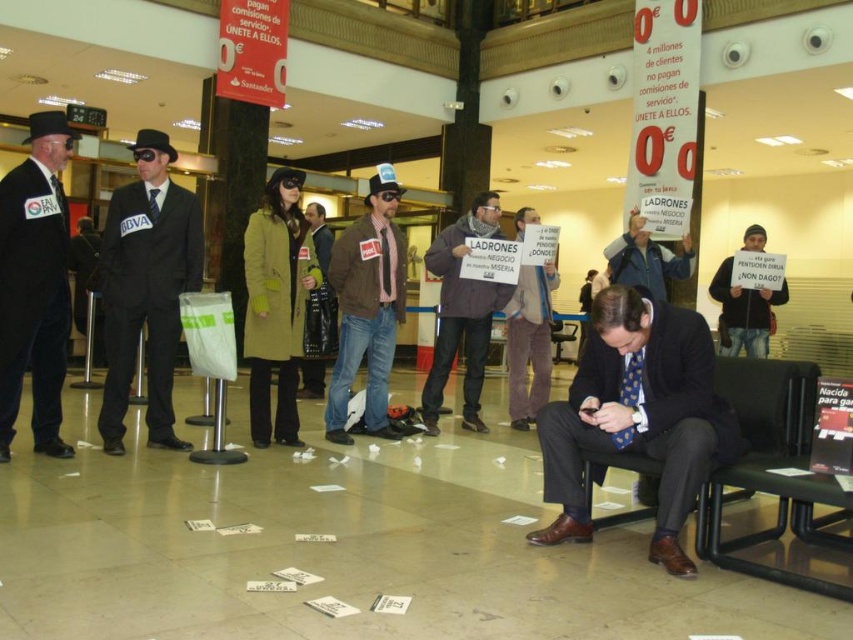
Question: Is matte black suit at lower right below gray fabric jacket at center?

Choices:
 (A) yes
 (B) no

Answer: (A)

Question: Among these points, which one is nearest to the camera?

Choices:
 (A) (53, 438)
 (B) (473, 419)
 (C) (650, 262)

Answer: (A)

Question: Which object is positioned closest to the denim jacket at center?

Choices:
 (A) matte black suit at center
 (B) black fabric sign at lower right

Answer: (A)

Question: Which point is farther to the camera?

Choices:
 (A) gray fabric jacket at center
 (B) velvet black coat at left
 (C) dark brown leather jacket at center
 (D) green wool coat at center

Answer: (A)

Question: Can you confirm if matte black suit at lower right is positioned above denim jacket at center?

Choices:
 (A) yes
 (B) no

Answer: (B)

Question: Does dark brown leather jacket at center have a larger size compared to gray fabric jacket at center?

Choices:
 (A) yes
 (B) no

Answer: (A)